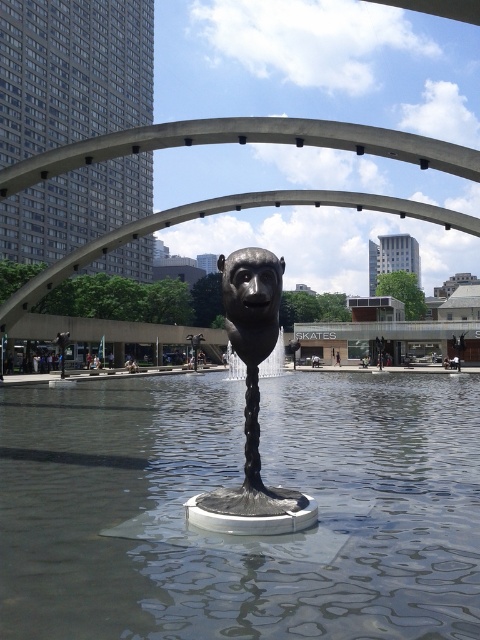
Does shiny metallic water at center have a larger size compared to shiny bronze face at center?

Yes, shiny metallic water at center is bigger than shiny bronze face at center.

Does point (373, 529) lie behind point (244, 288)?

Yes, point (373, 529) is behind point (244, 288).

I want to click on shiny metallic water at center, so click(x=235, y=481).

The image size is (480, 640). What are the coordinates of `shiny bronze sculpture at center` in the screenshot? It's located at (252, 404).

Who is shorter, shiny bronze sculpture at center or shiny bronze face at center?

shiny bronze face at center

The image size is (480, 640). What are the coordinates of `shiny bronze sculpture at center` in the screenshot? It's located at (252, 404).

Where is `shiny bronze sculpture at center`? This screenshot has height=640, width=480. shiny bronze sculpture at center is located at coordinates pos(252,404).

Between shiny metallic water at center and shiny bronze sculpture at center, which one has less height?

shiny metallic water at center is shorter.

Who is more distant from viewer, (76, 512) or (200, 525)?

The point (76, 512) is behind.

At what (x,y) coordinates should I click in order to perform the action: click on shiny metallic water at center. Please return your answer as a coordinate pair (x, y). Image resolution: width=480 pixels, height=640 pixels. Looking at the image, I should click on (235, 481).